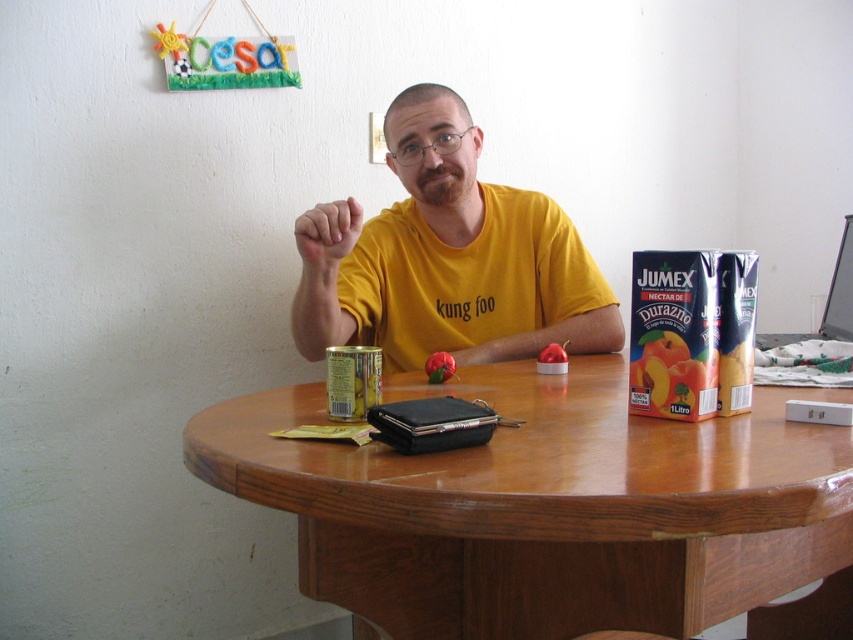
You are observing the man at the table. There are two points marked on the table. The first point is at coordinates point (364, 449) and the second point is at point (305, 244). Which of these two points is closer to you?

Point (364, 449) is closer to the viewer than point (305, 244).

You are standing in front of the wooden table and want to place a new item between the wooden at center and the yellow matte shirt at center. Based on their positions, which object should you place it closer to?

The wooden at center is positioned on the right side of yellow matte shirt at center. Therefore, to place the new item between them, you should position it closer to the yellow matte shirt at center since the wooden at center is already to its right.